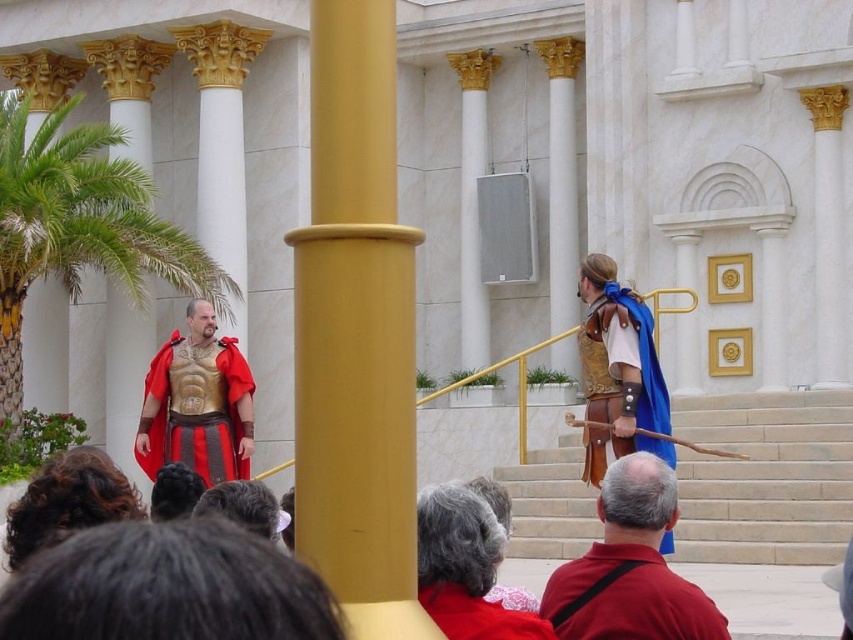
You are a costume designer examining the image of two historical figures. You need to determine which item is higher in position between the red leather belt at center and the gold metallic armor at center. Based on the scene description, which one is taller?

The red leather belt at center is taller than the gold metallic armor at center according to the description.

You are a stagehand standing behind the yellow matte pole at center. You need to move a 15 meter long banner from your current position to the platform where the two individuals are standing. Can you fit the banner between you and the platform without it touching the ground?

The distance between you and the platform is 14.49 meters, which is shorter than the 15 meter long banner. Therefore, the banner cannot be placed between you and the platform without bending or folding it, as the space is insufficient.

You are an artist trying to sketch the scene. You notice the red leather belt at center and the gold metallic armor at center. Which object should you draw first if you want to capture the most prominent feature?

The red leather belt at center is larger in size than the gold metallic armor at center, so you should draw the red leather belt at center first to capture the most prominent feature.